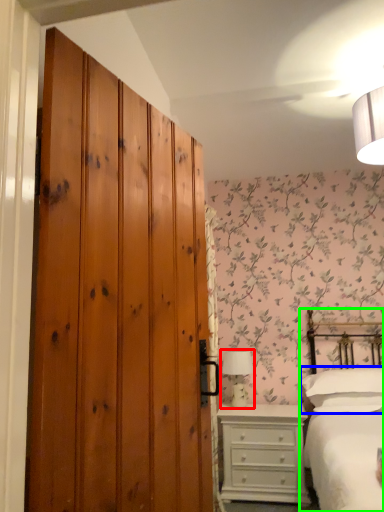
Question: Which is nearer to the table lamp (highlighted by a red box)? pillow (highlighted by a blue box) or bed (highlighted by a green box).

Choices:
 (A) pillow
 (B) bed

Answer: (A)